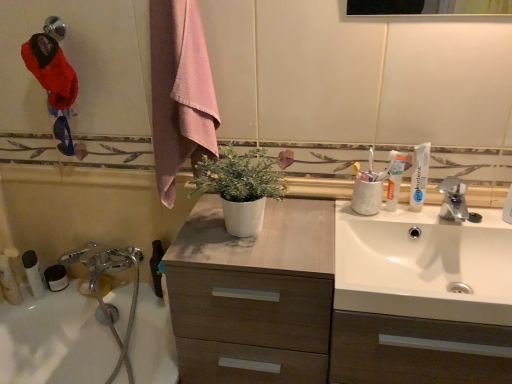
At what (x,y) coordinates should I click in order to perform the action: click on empty space that is to the right of white matte pot at center. Please return your answer as a coordinate pair (x, y). The width and height of the screenshot is (512, 384). Looking at the image, I should click on (313, 234).